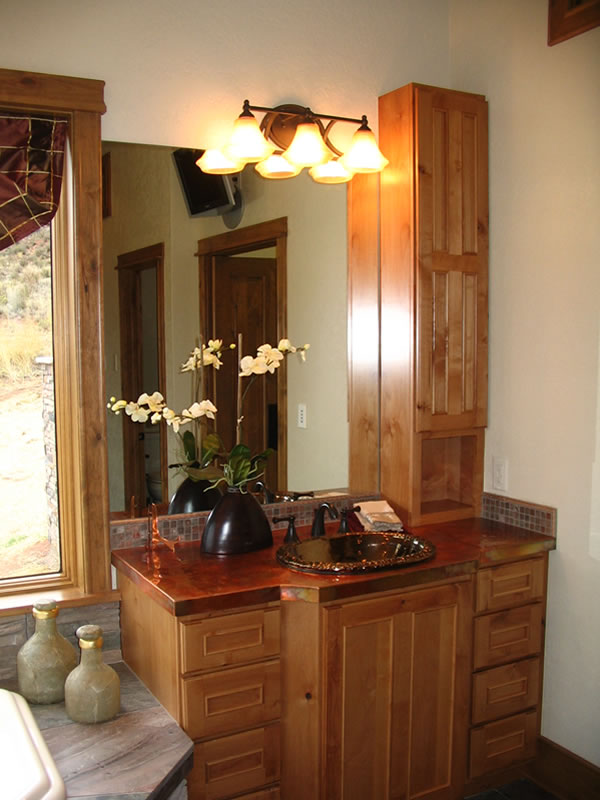
What are the coordinates of `storage area` in the screenshot? It's located at (449, 482).